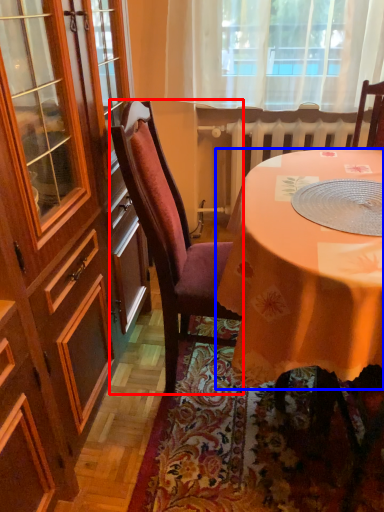
Question: Which of the following is the farthest to the observer, chair (highlighted by a red box) or desk (highlighted by a blue box)?

Choices:
 (A) chair
 (B) desk

Answer: (A)